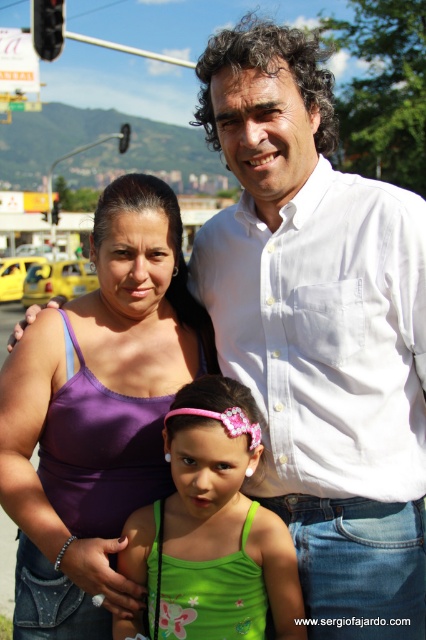
From the picture: You are a fashion designer observing the family in the image. You need to determine if the purple fabric tank top at center and the green fabric dress at center can be displayed side by side in a store window that is 20 inches wide. Can they fit together without overlapping?

The distance between the purple fabric tank top at center and the green fabric dress at center is 17.85 inches, which is less than the 20 inches width of the store window. Therefore, they can be displayed side by side without overlapping.

You are a photographer trying to capture a clear shot of both the purple fabric tank top at center and the green fabric dress at center. Since you want both items to be in focus, which one should you focus on first to ensure depth of field?

You should focus on the purple fabric tank top at center first because it is closer to you than the green fabric dress at center, allowing the depth of field to extend to the background object.

You are a fashion designer observing the family. You notice two garments at the center of the image. Which one has a wider silhouette? The options are the purple fabric tank top at center and the green fabric dress at center.

The purple fabric tank top at center is wider than the green fabric dress at center, so the purple fabric tank top at center has a wider silhouette.